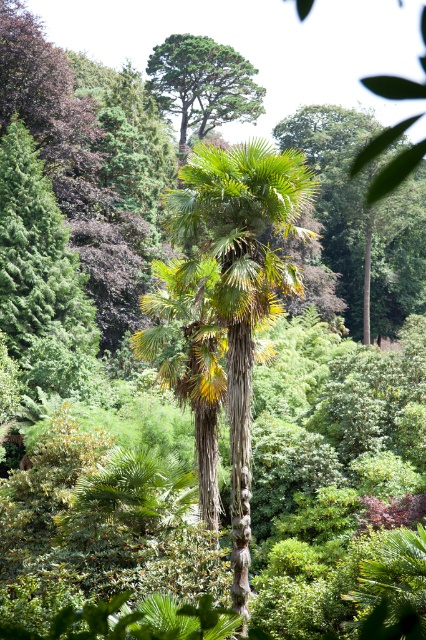
You are standing in the lush landscape and see the green leafy palm tree at center and the green leafy palm at center. Which one is positioned more to the left?

The green leafy palm tree at center is positioned more to the left than the green leafy palm at center.

You are standing at the center of the lush landscape and want to walk towards the point with coordinates closest to you. Which point should you head towards, point [359,298] or point [221,109]?

Point [221,109] is closer to you because it is in front of point [359,298], so you should head towards point [221,109].

You are standing at the center of the image and want to locate the green leafy palm tree at center. Based on the coordinates provided in the Objects Description, in which direction relative to your current position should you look to find it?

The green leafy palm tree at center is located at coordinates point (241,280). Since you are at the center of the image, which would be coordinates (213,320), the palm tree is slightly to the left and below your current position.